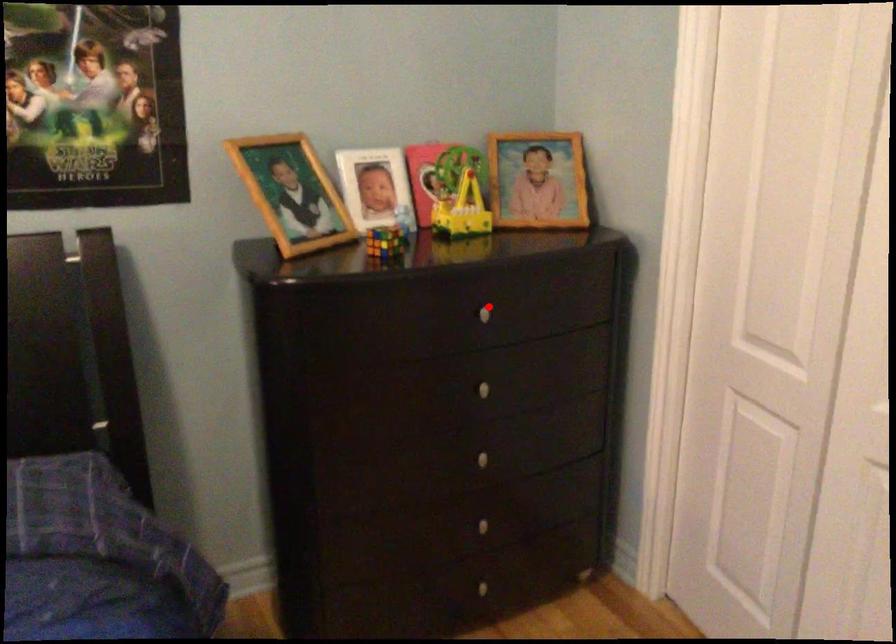
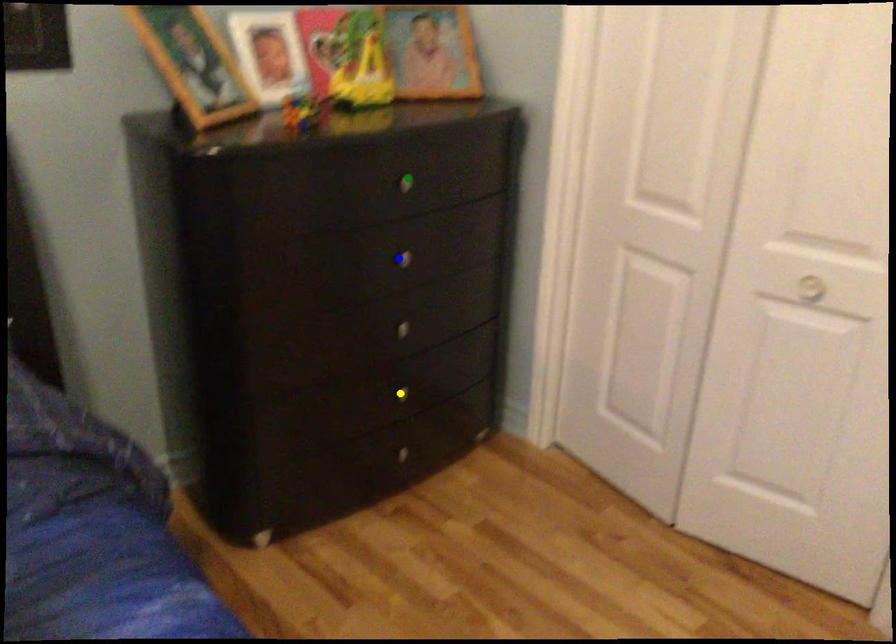
Question: I am providing you with two images of the same scene from different viewpoints. A red point is marked on the first image. You are given multiple points on the second image. Which mark in image 2 goes with the point in image 1?

Choices:
 (A) blue point
 (B) yellow point
 (C) green point

Answer: (C)